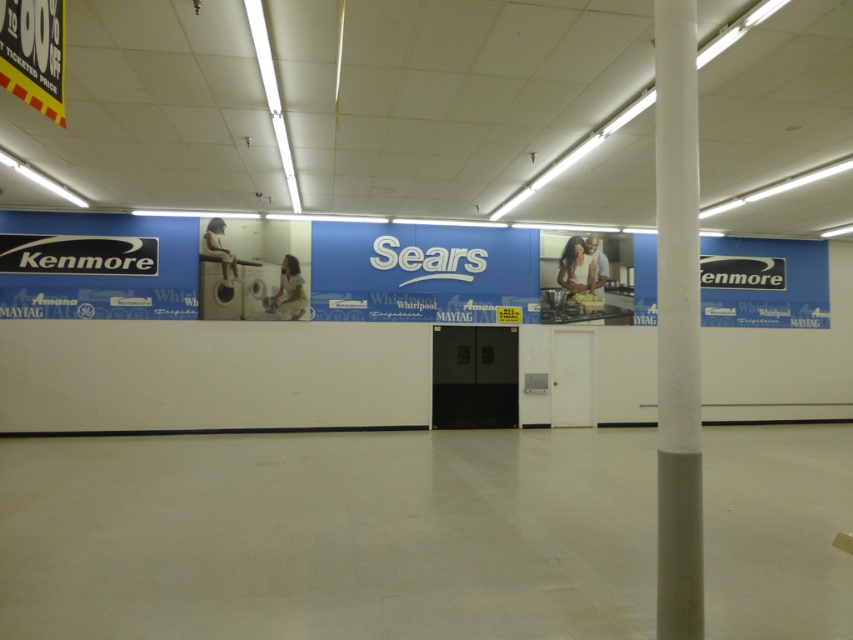
Question: Which point is farther to the camera?

Choices:
 (A) (706, 266)
 (B) (697, 524)

Answer: (A)

Question: Which point is farther to the camera?

Choices:
 (A) white matte sign at center
 (B) matte black sign at left

Answer: (A)

Question: Is the position of white smooth pole at right more distant than that of white matte sign at center?

Choices:
 (A) no
 (B) yes

Answer: (A)

Question: Can you confirm if white matte sign at center is smaller than blue matte kenmore sign at upper right?

Choices:
 (A) yes
 (B) no

Answer: (B)

Question: Where is white smooth pole at right located in relation to blue matte kenmore sign at upper right in the image?

Choices:
 (A) above
 (B) below

Answer: (B)

Question: Estimate the real-world distances between objects in this image. Which object is closer to the blue matte kenmore sign at upper right?

Choices:
 (A) white matte sign at center
 (B) matte black sign at left
 (C) white smooth pole at right

Answer: (A)